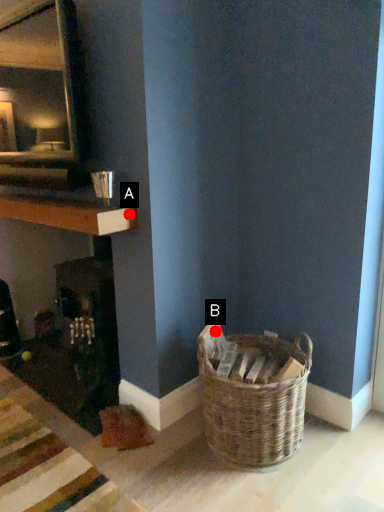
Question: Two points are circled on the image, labeled by A and B beside each circle. Which point is farther from the camera taking this photo?

Choices:
 (A) A is further
 (B) B is further

Answer: (B)